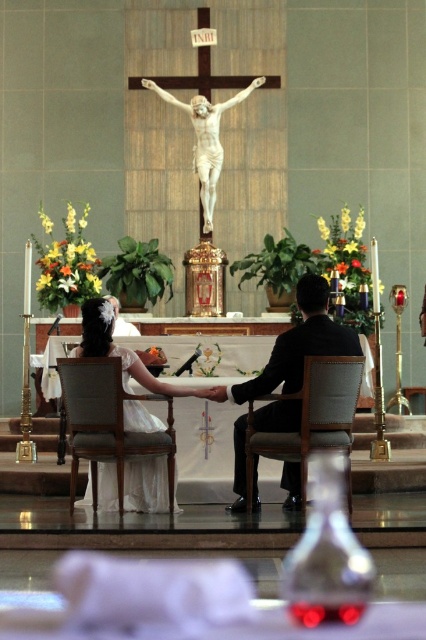
Can you confirm if white satin dress at center is wider than light brown fabric chair at center?

Yes.

Between white satin dress at center and light brown fabric chair at center, which one has more height?

white satin dress at center is taller.

This screenshot has width=426, height=640. I want to click on white satin dress at center, so click(296, 346).

Is white satin dress at center taller than light brown leather chair at center?

Yes, white satin dress at center is taller than light brown leather chair at center.

Which is more to the right, white satin dress at center or light brown leather chair at center?

From the viewer's perspective, light brown leather chair at center appears more on the right side.

This screenshot has height=640, width=426. In order to click on white satin dress at center in this screenshot , I will do coord(296,346).

What are the coordinates of `white satin dress at center` in the screenshot? It's located at (296, 346).

Is light brown fabric chair at center to the left of light brown leather chair at center from the viewer's perspective?

Indeed, light brown fabric chair at center is positioned on the left side of light brown leather chair at center.

Which of these two, light brown fabric chair at center or light brown leather chair at center, stands shorter?

Standing shorter between the two is light brown leather chair at center.

Is point (152, 400) farther from camera compared to point (314, 358)?

That is True.

Find the location of a particular element. The image size is (426, 640). light brown fabric chair at center is located at coordinates (108, 424).